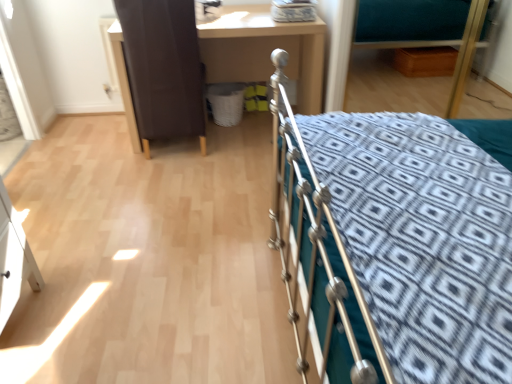
Question: Considering the relative sizes of brown leather screen door at upper left and silver metallic bed at right in the image provided, is brown leather screen door at upper left taller than silver metallic bed at right?

Choices:
 (A) no
 (B) yes

Answer: (A)

Question: Is brown leather screen door at upper left facing away from silver metallic bed at right?

Choices:
 (A) yes
 (B) no

Answer: (B)

Question: Considering the relative positions of brown leather screen door at upper left and silver metallic bed at right in the image provided, is brown leather screen door at upper left to the left of silver metallic bed at right from the viewer's perspective?

Choices:
 (A) no
 (B) yes

Answer: (B)

Question: Is silver metallic bed at right completely or partially inside brown leather screen door at upper left?

Choices:
 (A) yes
 (B) no

Answer: (B)

Question: Considering the relative sizes of brown leather screen door at upper left and silver metallic bed at right in the image provided, is brown leather screen door at upper left smaller than silver metallic bed at right?

Choices:
 (A) no
 (B) yes

Answer: (B)

Question: From the image's perspective, would you say brown leather screen door at upper left is positioned over silver metallic bed at right?

Choices:
 (A) yes
 (B) no

Answer: (A)

Question: From the image's perspective, does brown leather screen door at upper left appear higher than teal fabric hospital bed at upper right?

Choices:
 (A) yes
 (B) no

Answer: (B)

Question: From the image's perspective, is brown leather screen door at upper left located beneath teal fabric hospital bed at upper right?

Choices:
 (A) yes
 (B) no

Answer: (A)

Question: Can you confirm if brown leather screen door at upper left is bigger than teal fabric hospital bed at upper right?

Choices:
 (A) no
 (B) yes

Answer: (B)

Question: Considering the relative positions of brown leather screen door at upper left and teal fabric hospital bed at upper right in the image provided, is brown leather screen door at upper left to the left of teal fabric hospital bed at upper right from the viewer's perspective?

Choices:
 (A) no
 (B) yes

Answer: (B)

Question: Is brown leather screen door at upper left wider than teal fabric hospital bed at upper right?

Choices:
 (A) no
 (B) yes

Answer: (B)

Question: From a real-world perspective, is brown leather screen door at upper left on top of teal fabric hospital bed at upper right?

Choices:
 (A) no
 (B) yes

Answer: (A)

Question: Is teal fabric hospital bed at upper right smaller than matte brown desk at center?

Choices:
 (A) yes
 (B) no

Answer: (A)